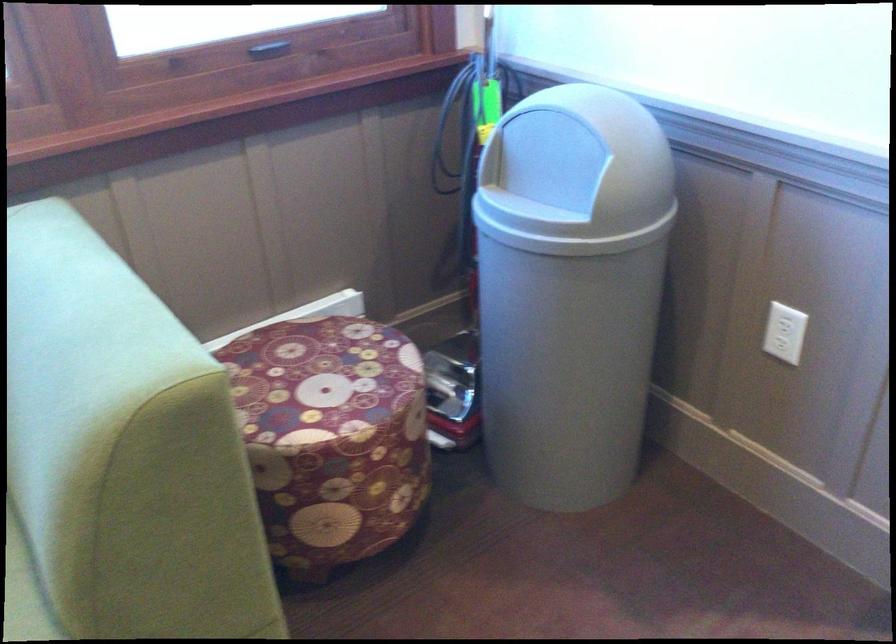
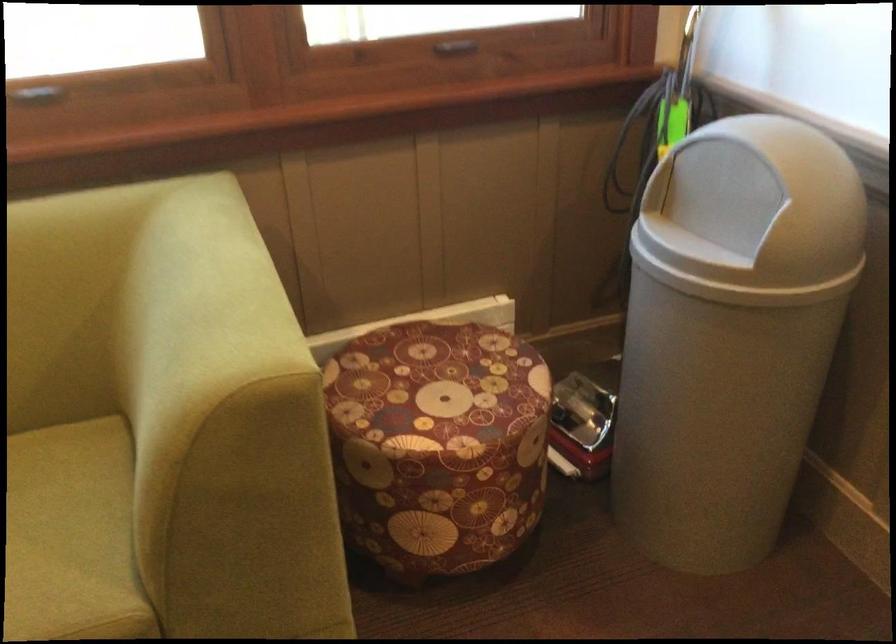
What movement of the cameraman would produce the second image?

The cameraman moved toward right, forward.